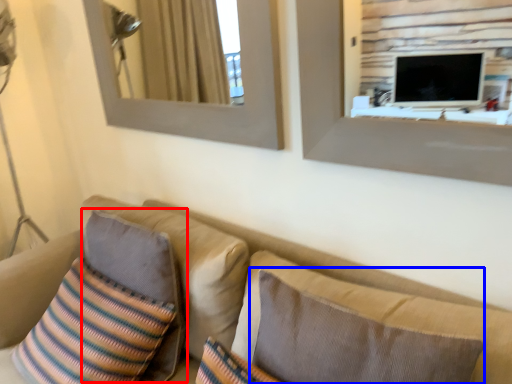
Question: Which object appears farthest to the camera in this image, pillow (highlighted by a red box) or pillow (highlighted by a blue box)?

Choices:
 (A) pillow
 (B) pillow

Answer: (A)